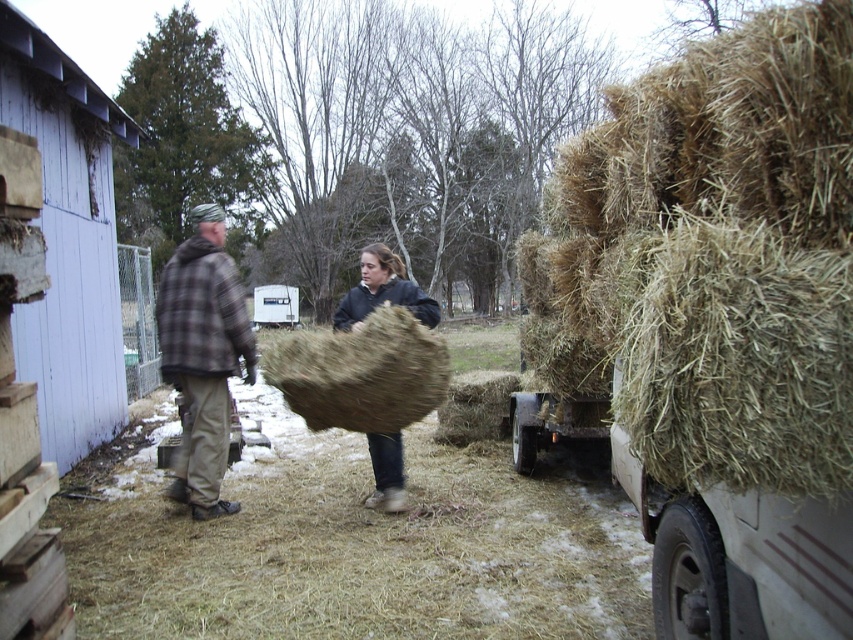
You are standing in the farmyard and want to hand a tool to both the person wearing the brown plaid shirt at center and the person wearing the dark brown woolen sweater at center. Which person should you give the tool to first to ensure they can reach it without needing to move?

You should give the tool first to the brown plaid shirt at center because they are closer to you than the dark brown woolen sweater at center.

You are standing in the farmyard and want to place a new fence post exactly halfway between point (184, 321) and point (386, 300). Which point is closer to the camera where you are standing?

Point (184, 321) is closer to the camera than point (386, 300), so the halfway point between them would be closer to the camera than the farther point.

Based on the photo, you are standing in the farmyard and want to hand a tool to both the plaid fabric jacket at left and the brown plaid shirt at center. Which one should you give the tool to first based on their proximity to you?

You should give the tool to the plaid fabric jacket at left first because it is closer to you than the brown plaid shirt at center, which is further away.